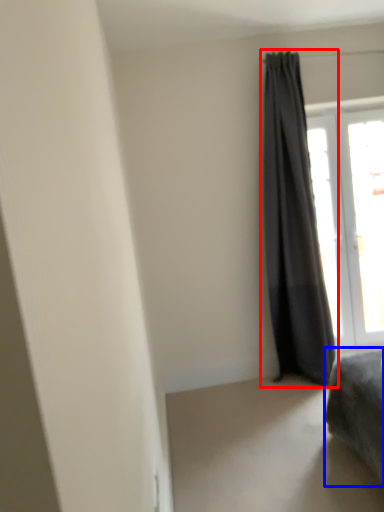
Question: Which point is further to the camera, curtain (highlighted by a red box) or furniture (highlighted by a blue box)?

Choices:
 (A) curtain
 (B) furniture

Answer: (A)